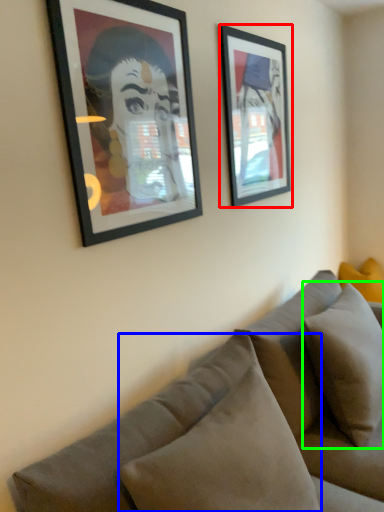
Question: Estimate the real-world distances between objects in this image. Which object is farther from picture frame (highlighted by a red box), pillow (highlighted by a blue box) or pillow (highlighted by a green box)?

Choices:
 (A) pillow
 (B) pillow

Answer: (A)